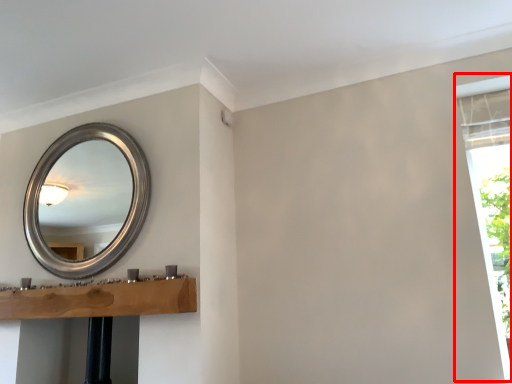
Question: In this image, where is window frame (annotated by the red box) located relative to mirror?

Choices:
 (A) left
 (B) right

Answer: (B)